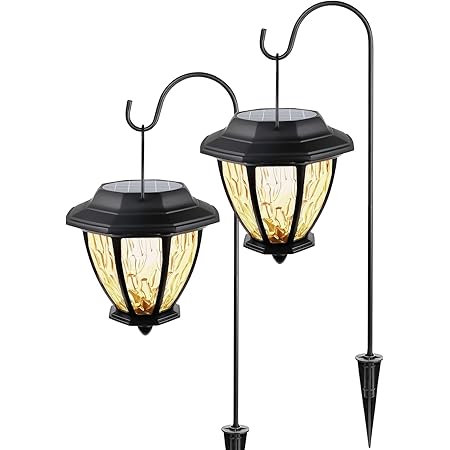
Identify the location of bottom of lamp. (123, 317).